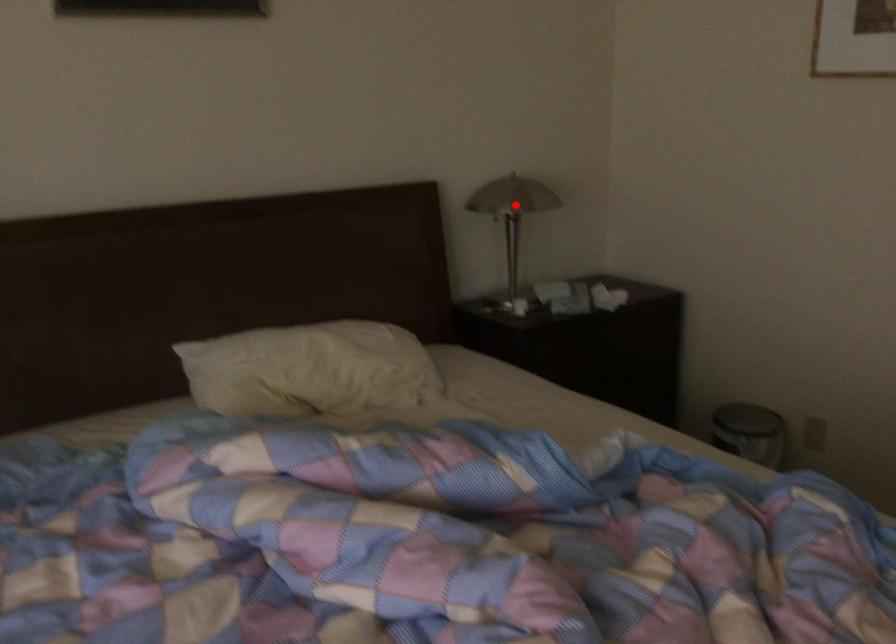
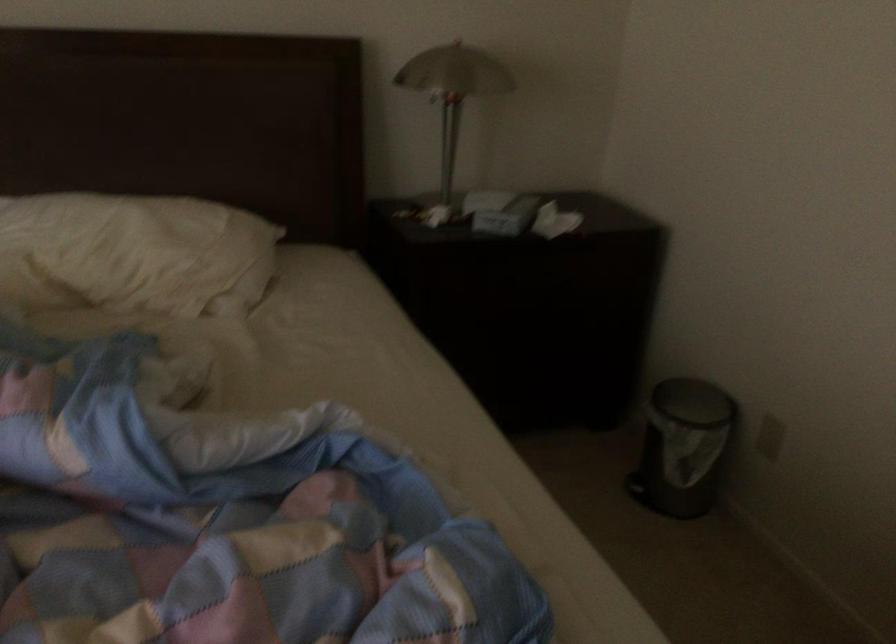
The point at the highlighted location is marked in the first image. Where is the corresponding point in the second image?

(453, 91)